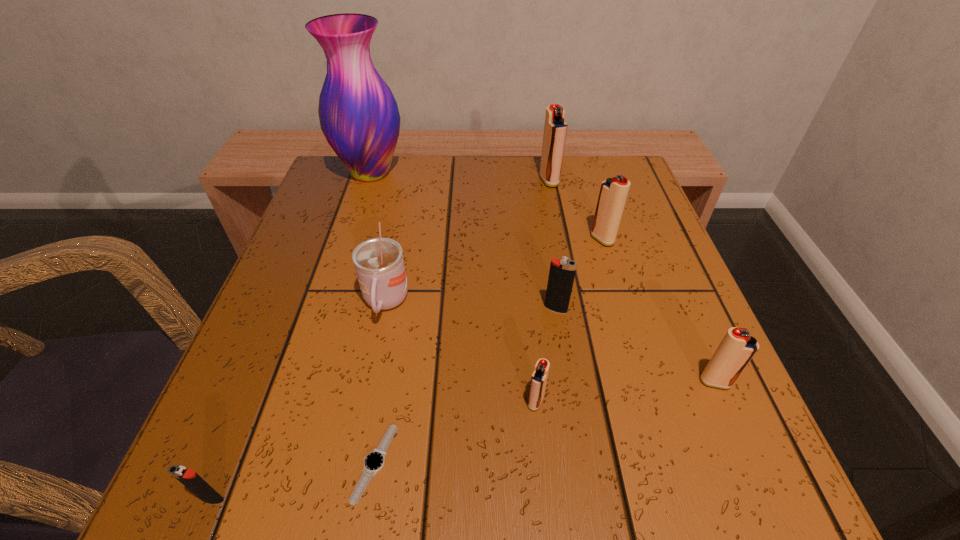
This screenshot has height=540, width=960. Identify the location of free space that satisfies the following two spatial constraints: 1. on the front side of the second nearest red igniter; 2. on the right side of the farther black igniter. (567, 382).